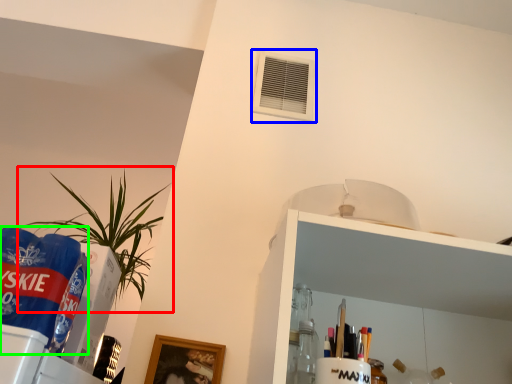
Question: Which object is the closest to the houseplant (highlighted by a red box)? Choose among these: air conditioning (highlighted by a blue box) or beverage (highlighted by a green box).

Choices:
 (A) air conditioning
 (B) beverage

Answer: (A)